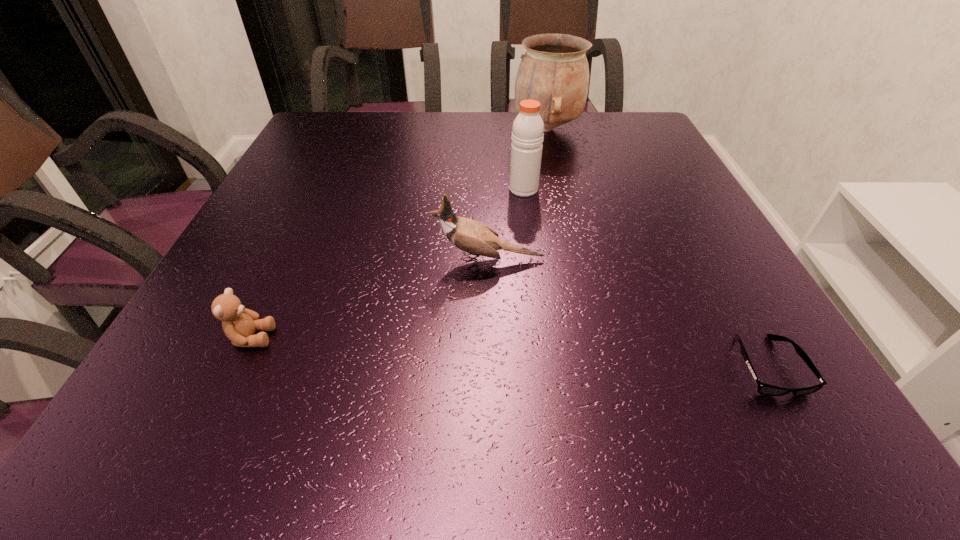
Identify the location of vacant point located between the bird and the sunglasses. (628, 313).

Identify the location of vacant space in between the second farthest object and the third tallest object. This screenshot has width=960, height=540. (506, 225).

I want to click on empty space that is in between the second shortest object and the farthest object, so click(x=399, y=233).

The image size is (960, 540). I want to click on vacant space in between the teddy bear and the urn, so click(x=399, y=233).

Locate an element on the screen. The width and height of the screenshot is (960, 540). free spot between the farthest object and the teddy bear is located at coordinates (399, 233).

Locate an element on the screen. This screenshot has width=960, height=540. unoccupied position between the leftmost object and the farthest object is located at coordinates (399, 233).

Find the location of a particular element. This screenshot has height=540, width=960. object that is the second closest to the rightmost object is located at coordinates tap(527, 132).

Select which object appears as the second closest to the urn. Please provide its 2D coordinates. Your answer should be formatted as a tuple, i.e. [(x, y)], where the tuple contains the x and y coordinates of a point satisfying the conditions above.

[(476, 238)]

At what (x,y) coordinates should I click in order to perform the action: click on free spot that satisfies the following two spatial constraints: 1. on the back side of the fourth nearest object; 2. on the right side of the farthest object. Please return your answer as a coordinate pair (x, y). Looking at the image, I should click on click(516, 129).